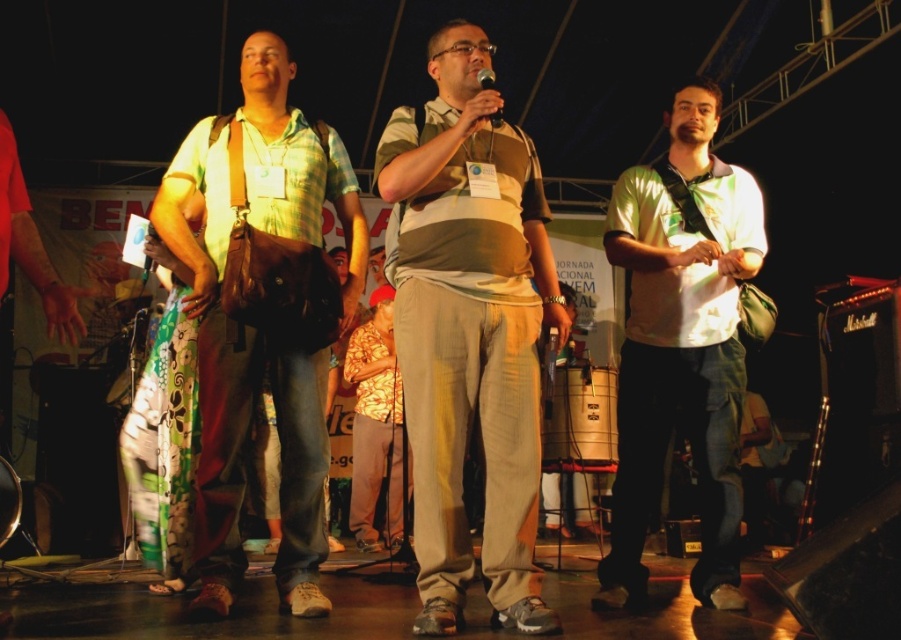
Between matte beige pants at center and matte black microphone at center, which one is positioned higher?

matte black microphone at center

This screenshot has width=901, height=640. What do you see at coordinates (469, 330) in the screenshot?
I see `matte beige pants at center` at bounding box center [469, 330].

Where is `matte beige pants at center`? This screenshot has width=901, height=640. matte beige pants at center is located at coordinates (469, 330).

Who is positioned more to the left, matte beige pants at center or light green fabric shirt at center?

matte beige pants at center

Is matte beige pants at center positioned before light green fabric shirt at center?

Yes, it is.

Who is more forward, [472,163] or [713,88]?

Positioned in front is point [472,163].

The height and width of the screenshot is (640, 901). What are the coordinates of `matte beige pants at center` in the screenshot? It's located at (469, 330).

Does matte brown bag at left have a greater height compared to matte black microphone at center?

Yes, matte brown bag at left is taller than matte black microphone at center.

Which of these two, matte brown bag at left or matte black microphone at center, stands shorter?

With less height is matte black microphone at center.

Find the location of `matte brown bag at left`. matte brown bag at left is located at coordinates (256, 330).

At what (x,y) coordinates should I click in order to perform the action: click on matte brown bag at left. Please return your answer as a coordinate pair (x, y). Looking at the image, I should click on (256, 330).